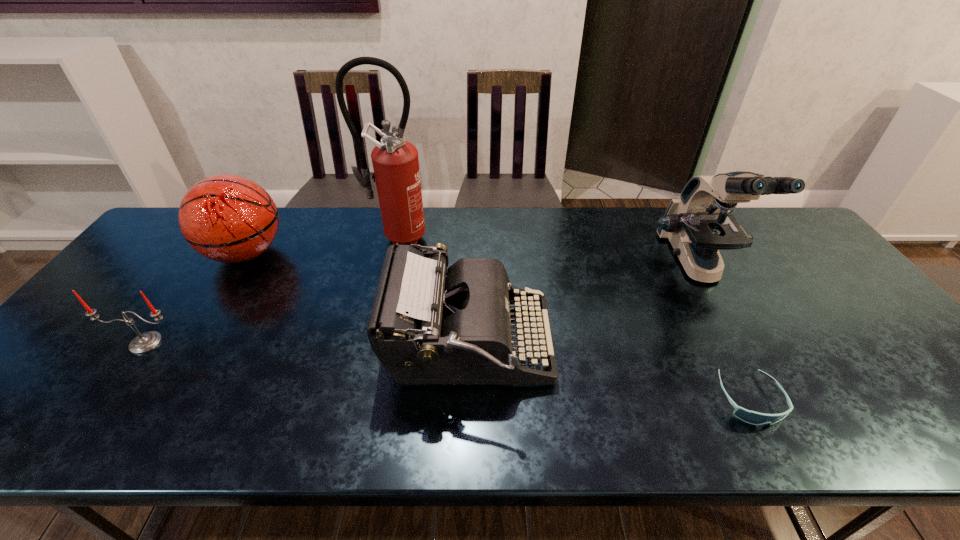
Locate an element on the screen. The width and height of the screenshot is (960, 540). fire extinguisher is located at coordinates (395, 161).

Identify the location of the second tallest object. (698, 224).

Find the location of a particular element. The height and width of the screenshot is (540, 960). basketball is located at coordinates point(227,218).

Where is `typewriter`? typewriter is located at coordinates (429, 325).

Where is `candle`? The width and height of the screenshot is (960, 540). candle is located at coordinates (145, 342).

This screenshot has width=960, height=540. I want to click on the shortest object, so click(751, 417).

I want to click on vacant space located at the nozzle of the tallest object, so click(x=380, y=308).

Image resolution: width=960 pixels, height=540 pixels. In order to click on free spot located through the eyepieces of the microscope in this screenshot , I will do `click(730, 325)`.

I want to click on vacant region located on the side with spill of the basketball, so click(314, 253).

What are the coordinates of `vacant space located on the front-facing side of the typewriter` in the screenshot? It's located at (698, 346).